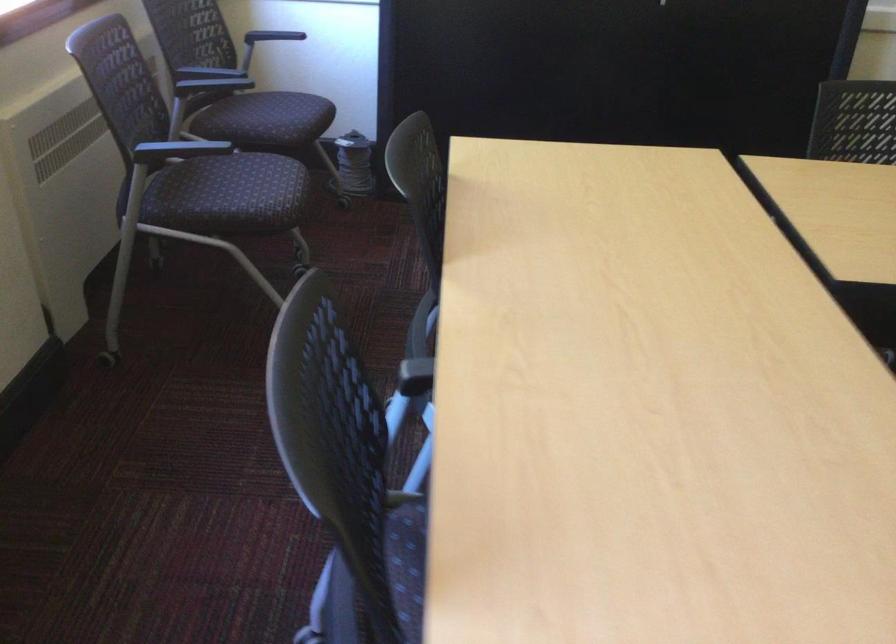
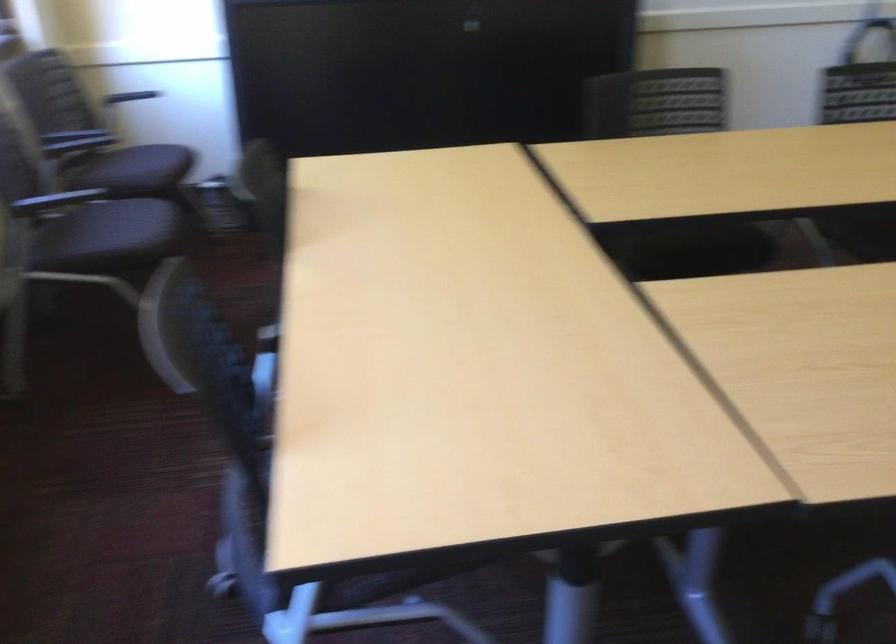
The point at (270, 118) is marked in the first image. Where is the corresponding point in the second image?

(135, 169)